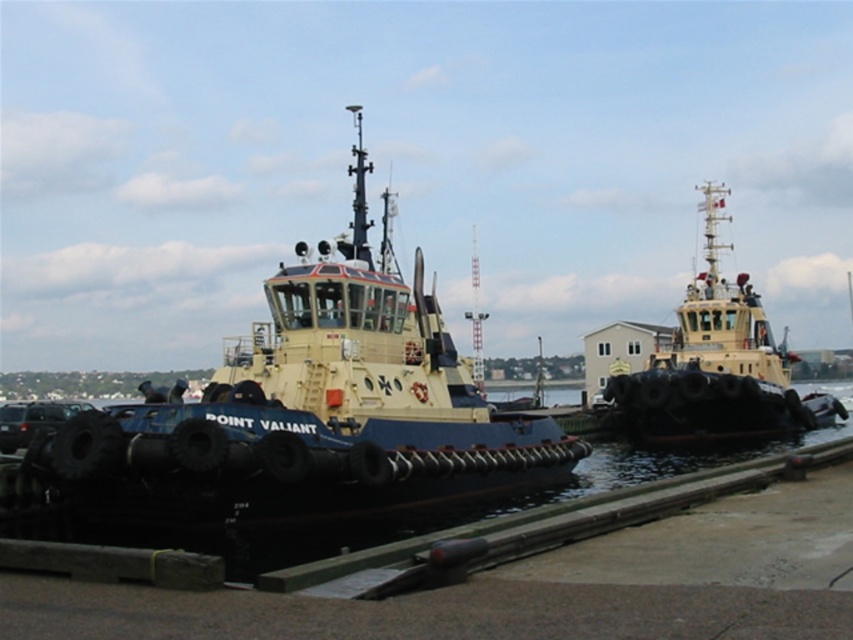
You are a harbor worker who needs to move a container from the yellow matte tugboat at upper right to the yellow matte tugboat at center. Which direction should you move the container to ensure it reaches the correct tugboat?

You should move the container to the left, as the yellow matte tugboat at center is located to the left of the yellow matte tugboat at upper right.